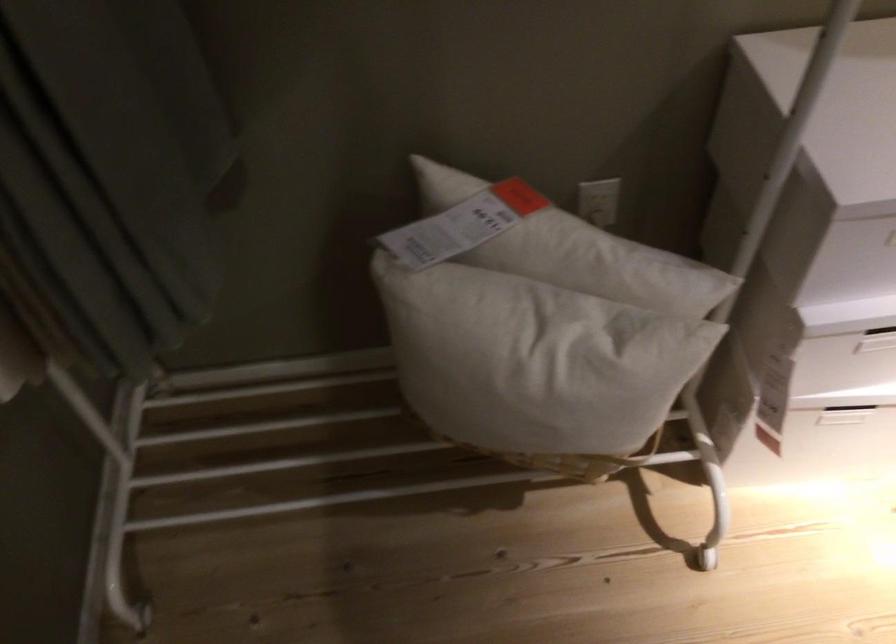
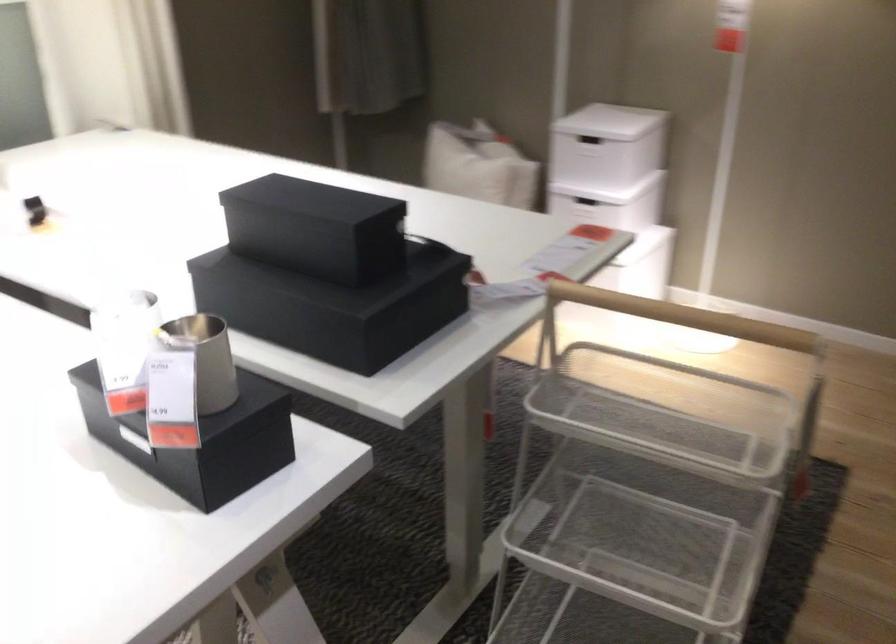
Question: I am providing you with two images of the same scene from different viewpoints. Please identify which objects are invisible in image2.

Choices:
 (A) small black box
 (B) silver mechanical latch
 (C) electrical outlet
 (D) white box handle

Answer: (C)